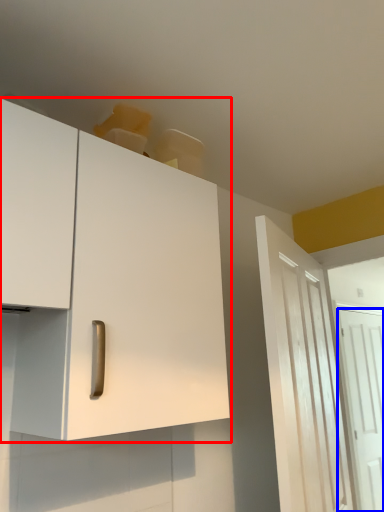
Question: Which object is closer to the camera taking this photo, cabinetry (highlighted by a red box) or door (highlighted by a blue box)?

Choices:
 (A) cabinetry
 (B) door

Answer: (A)